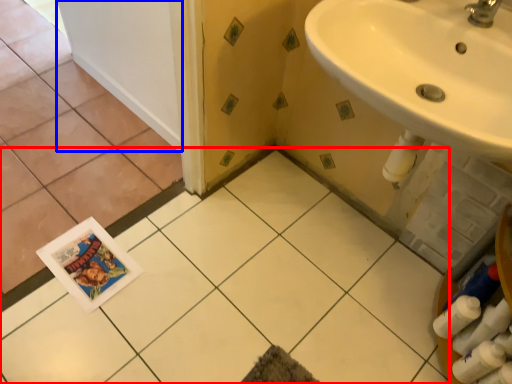
Question: Among these objects, which one is nearest to the camera, ceramic tile (highlighted by a red box) or door (highlighted by a blue box)?

Choices:
 (A) ceramic tile
 (B) door

Answer: (A)